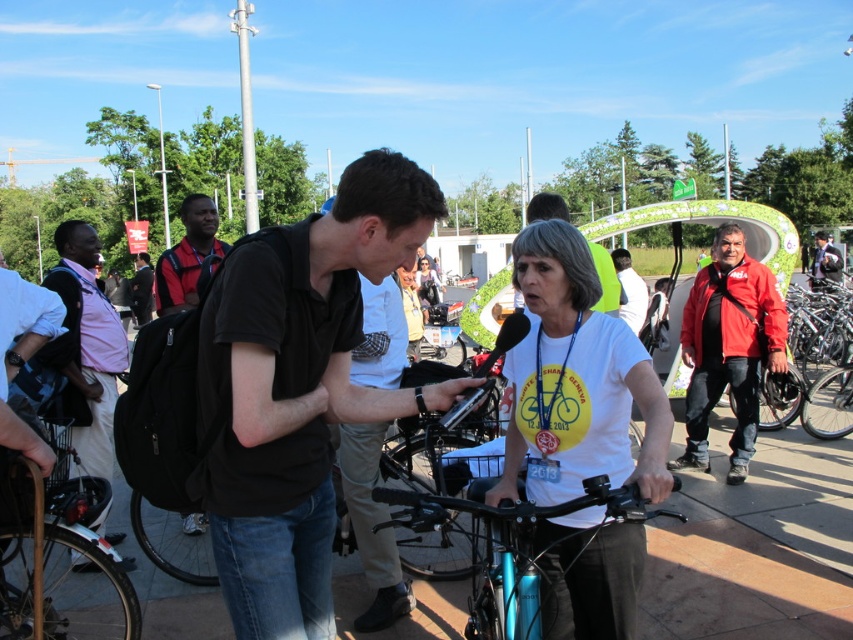
Question: Which of these objects is positioned closest to the white shirt at center?

Choices:
 (A) black cotton shirt at center
 (B) matte black shirt at center
 (C) red jacket at center
 (D) white matte shirt at center

Answer: (C)

Question: Is white matte shirt at center positioned at the back of black backpack at left?

Choices:
 (A) yes
 (B) no

Answer: (B)

Question: Which object appears farthest from the camera in this image?

Choices:
 (A) white matte shirt at center
 (B) matte black shirt at center
 (C) wooden frame bicycle at lower left

Answer: (C)

Question: Is matte black shirt at center further to the viewer compared to dark blue jacket at center?

Choices:
 (A) yes
 (B) no

Answer: (B)

Question: Does dark blue jacket at center have a smaller size compared to dark blue backpack at center?

Choices:
 (A) no
 (B) yes

Answer: (A)

Question: Which point appears farthest from the camera in this image?

Choices:
 (A) (80, 595)
 (B) (132, 285)
 (C) (624, 296)

Answer: (B)